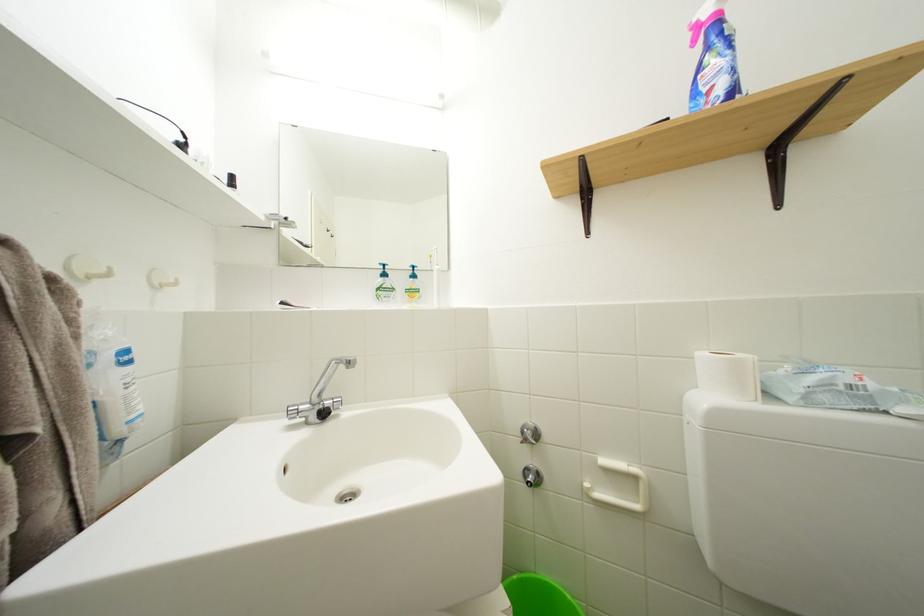
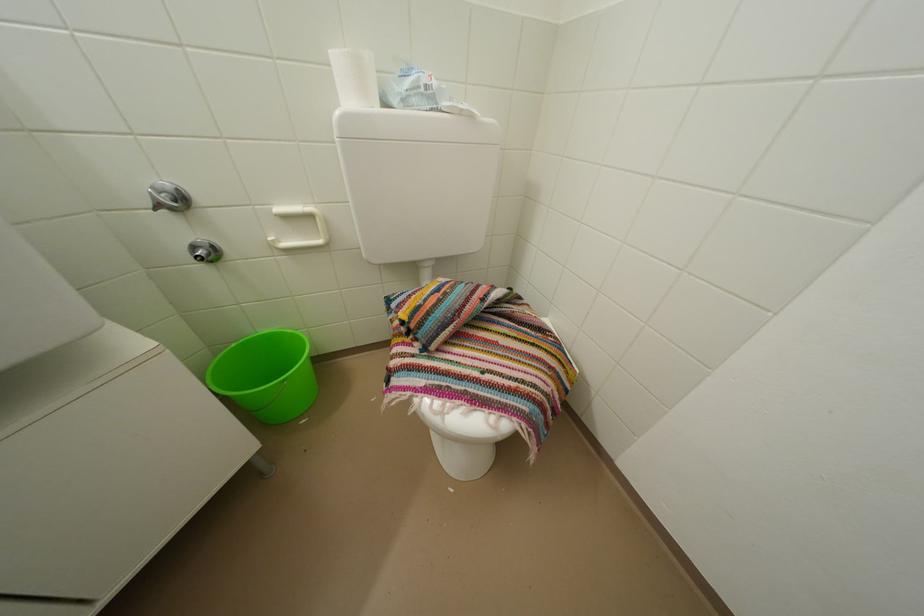
First-person continuous shooting, in which direction is the camera rotating?

The camera's rotation is toward right-down.